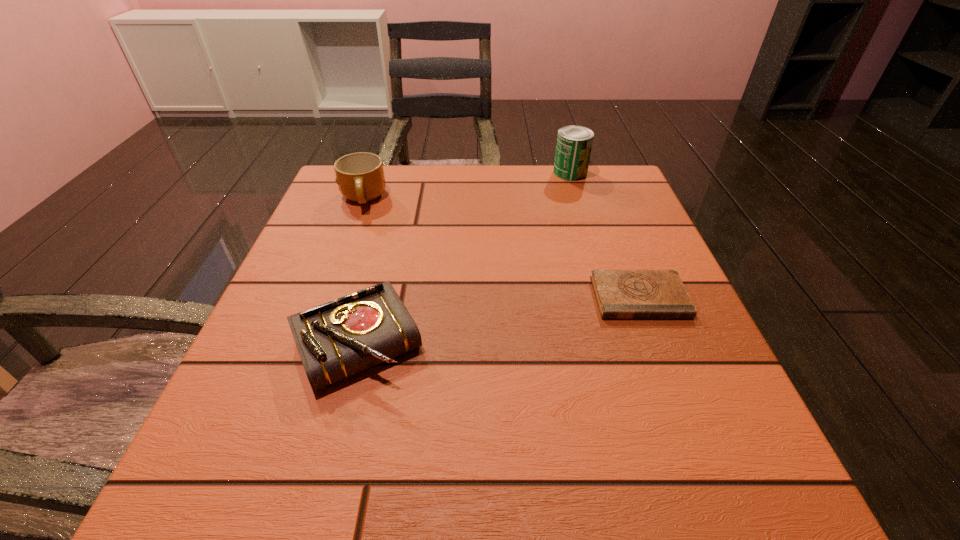
Locate an element on the screen. free space between the can and the second farthest object is located at coordinates (467, 186).

The width and height of the screenshot is (960, 540). What are the coordinates of `free spot between the shorter diary and the farthest object` in the screenshot? It's located at (605, 235).

The image size is (960, 540). I want to click on free spot between the tallest object and the third shortest object, so click(x=467, y=186).

I want to click on vacant area that lies between the right diary and the farthest object, so click(605, 235).

This screenshot has width=960, height=540. Find the location of `free space between the taller diary and the shortest object`. free space between the taller diary and the shortest object is located at coordinates click(498, 320).

The image size is (960, 540). What are the coordinates of `vacant region between the shorter diary and the second farthest object` in the screenshot? It's located at (501, 248).

The width and height of the screenshot is (960, 540). I want to click on object that is the closest one to the right diary, so click(x=335, y=340).

Image resolution: width=960 pixels, height=540 pixels. What are the coordinates of `object that is the closest to the second farthest object` in the screenshot? It's located at (335, 340).

Image resolution: width=960 pixels, height=540 pixels. I want to click on free space that satisfies the following two spatial constraints: 1. on the side with the handle of the mug; 2. on the left side of the second shortest object, so click(x=310, y=344).

You are a GUI agent. You are given a task and a screenshot of the screen. Output one action in this format:
    pyautogui.click(x=<x>, y=<y>)
    Task: Click on the vacant space that satisfies the following two spatial constraints: 1. on the back side of the can; 2. on the left side of the taller diary
    This screenshot has width=960, height=540.
    Given the screenshot: What is the action you would take?
    pyautogui.click(x=403, y=172)